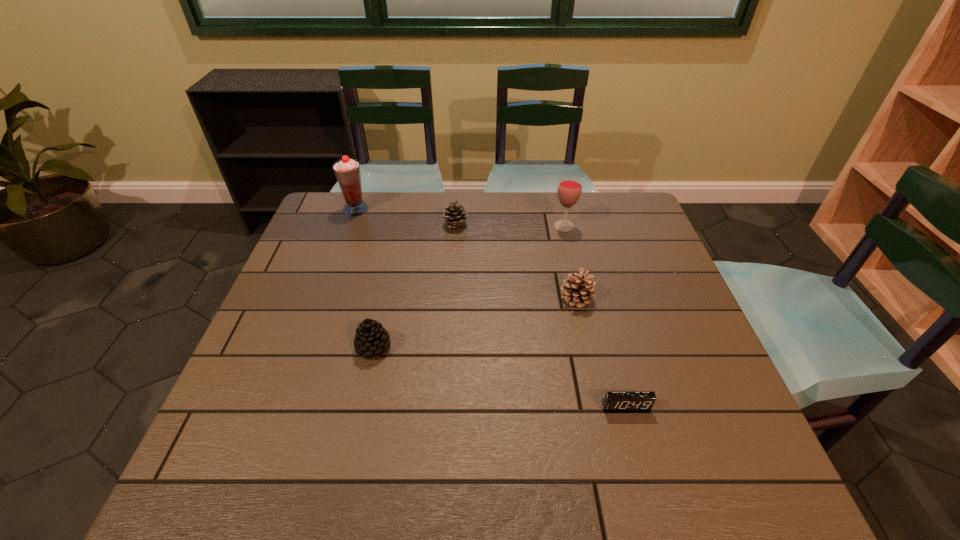
Identify the location of free spot between the farthest pinecone and the second object from left to right. (x=415, y=286).

Where is `vacant area that lies between the third nearest object and the nearest pinecone`? The height and width of the screenshot is (540, 960). vacant area that lies between the third nearest object and the nearest pinecone is located at coordinates (475, 323).

Find the location of a particular element. blank region between the second pinecone from right to left and the leftmost object is located at coordinates (406, 217).

Locate an element on the screen. The height and width of the screenshot is (540, 960). free space between the farthest pinecone and the third nearest object is located at coordinates (516, 261).

Find the location of `vacant area that lies between the nearest pinecone and the farthest object`. vacant area that lies between the nearest pinecone and the farthest object is located at coordinates (x=365, y=278).

This screenshot has height=540, width=960. I want to click on empty space that is in between the alarm clock and the farthest object, so click(x=491, y=308).

Find the location of a particular element. This screenshot has width=960, height=540. free space between the smoothie and the nearest object is located at coordinates (491, 308).

This screenshot has width=960, height=540. I want to click on object that is the fifth closest to the farthest pinecone, so click(x=614, y=400).

Point out which object is positioned as the second nearest to the wineglass. Please provide its 2D coordinates. Your answer should be formatted as a tuple, i.e. [(x, y)], where the tuple contains the x and y coordinates of a point satisfying the conditions above.

[(454, 216)]

Point out which pinecone is positioned as the nearest to the fourth farthest object. Please provide its 2D coordinates. Your answer should be formatted as a tuple, i.e. [(x, y)], where the tuple contains the x and y coordinates of a point satisfying the conditions above.

[(454, 216)]